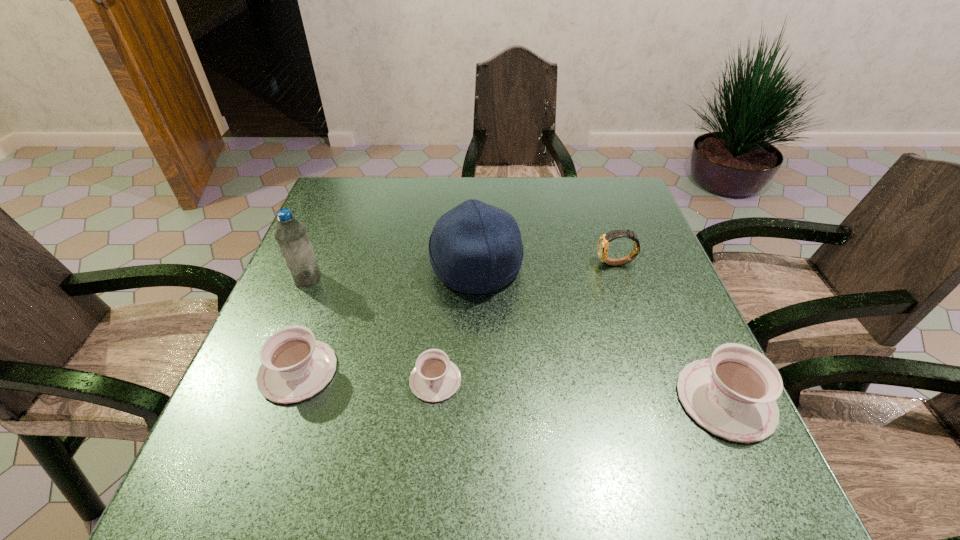
At what (x,y) coordinates should I click in order to perform the action: click on free space between the skullcap and the water bottle. Please return your answer as a coordinate pair (x, y). Image resolution: width=960 pixels, height=540 pixels. Looking at the image, I should click on (392, 273).

The width and height of the screenshot is (960, 540). Identify the location of free space between the rightmost teacup and the second teacup from left to right. (581, 390).

The image size is (960, 540). I want to click on object that is the closest to the rightmost teacup, so click(603, 243).

Select which object is the fifth closest to the rightmost teacup. Please provide its 2D coordinates. Your answer should be formatted as a tuple, i.e. [(x, y)], where the tuple contains the x and y coordinates of a point satisfying the conditions above.

[(291, 235)]

Locate an element on the screen. The image size is (960, 540). teacup that stands as the closest to the rightmost teacup is located at coordinates (435, 378).

Find the location of `teacup that stands as the closest to the rightmost teacup`. teacup that stands as the closest to the rightmost teacup is located at coordinates (435, 378).

Locate an element on the screen. free space that satisfies the following two spatial constraints: 1. on the handle side of the second tallest teacup; 2. on the right side of the skullcap is located at coordinates (336, 267).

What are the coordinates of `free spot that satisfies the following two spatial constraints: 1. on the face of the watch; 2. on the handle side of the second teacup from left to right` in the screenshot? It's located at (656, 380).

The height and width of the screenshot is (540, 960). I want to click on vacant position in the image that satisfies the following two spatial constraints: 1. on the handle side of the skullcap; 2. on the right side of the leftmost teacup, so click(x=336, y=267).